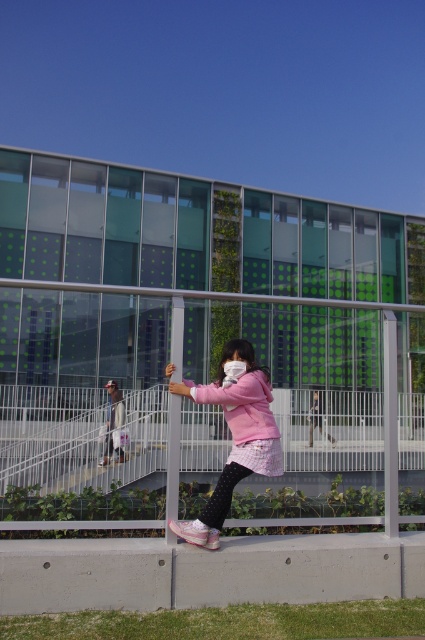
You are a fashion designer observing two jackets displayed at a store window. The pink matte jacket at center and the light pink fabric jacket at center. Which jacket takes up more space in the display?

The light pink fabric jacket at center takes up more space in the display than the pink matte jacket at center.

You are standing at the point marked by the coordinates point (234, 435). Looking around, you see the pink matte jacket at center. Where is the pink matte jacket located relative to your current position?

The pink matte jacket at center is located at the same position as your current coordinates point (234, 435).

In the scene shown: You are a fashion designer observing two jackets displayed in the center of an outdoor modern building scene. The jackets are labeled as the pink matte jacket at center and the light pink fabric jacket at center. Which jacket appears shorter in height?

The pink matte jacket at center has a lesser height compared to the light pink fabric jacket at center, so the pink matte jacket at center appears shorter.